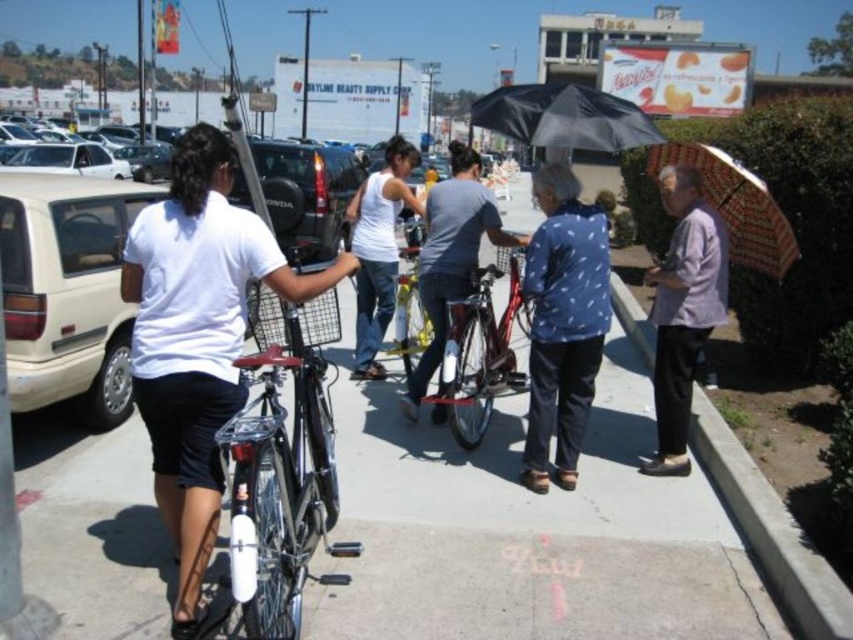
You are standing on the sidewalk and see the shiny silver bicycle at center and the matte gray shirt at center. Which object is positioned more to the left?

The shiny silver bicycle at center is positioned to the left of the matte gray shirt at center, so it is more to the left.

You are standing at point (833, 620) and want to walk to point (73, 532). Is there any obstruction between you and your destination?

Point (73, 532) is behind point (833, 620), so there is no obstruction between you and your destination.